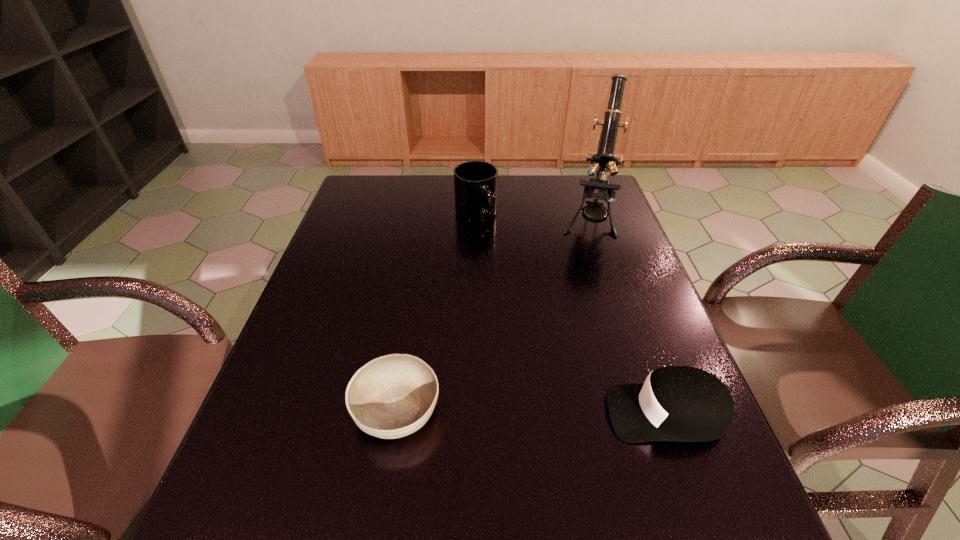
I want to click on bowl, so click(x=392, y=396).

You are a GUI agent. You are given a task and a screenshot of the screen. Output one action in this format:
    pyautogui.click(x=<x>, y=<y>)
    Task: Click on the third tallest object
    
    Given the screenshot: What is the action you would take?
    pyautogui.click(x=675, y=403)

The width and height of the screenshot is (960, 540). What are the coordinates of `the second tallest object` in the screenshot? It's located at (475, 182).

Identify the location of microscope. The width and height of the screenshot is (960, 540). (604, 161).

I want to click on vacant space located on the left of the shortest object, so click(x=307, y=410).

Find the location of a particular element. This screenshot has width=960, height=540. free space located 0.140m on the front-facing side of the second shortest object is located at coordinates (538, 413).

Identify the location of blank area located 0.270m on the front-facing side of the second shortest object. (473, 413).

Locate an element on the screen. The image size is (960, 540). vacant position located on the front-facing side of the second shortest object is located at coordinates (513, 413).

Identify the location of vacant space located with the handle on the side of the mug. The height and width of the screenshot is (540, 960). (487, 255).

The width and height of the screenshot is (960, 540). Identify the location of blank space located 0.290m with the handle on the side of the mug. (498, 293).